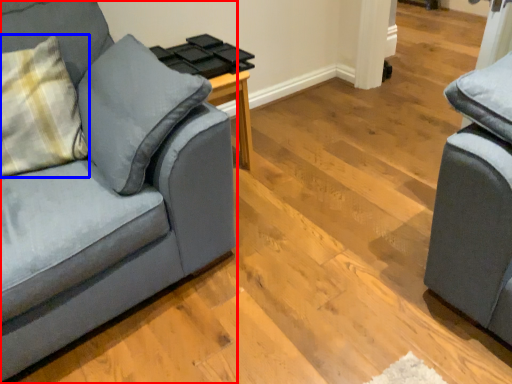
Question: Which point is further to the camera, studio couch (highlighted by a red box) or throw pillow (highlighted by a blue box)?

Choices:
 (A) studio couch
 (B) throw pillow

Answer: (B)